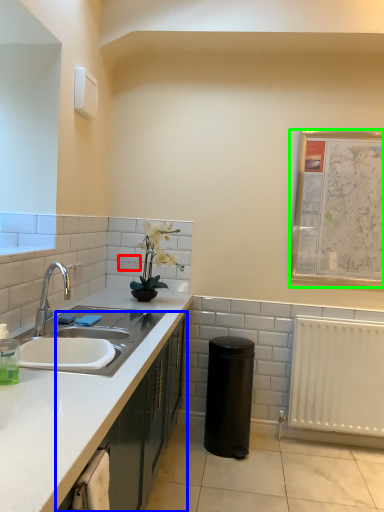
Question: Which object is positioned closest to electric outlet (highlighted by a red box)? Select from cabinetry (highlighted by a blue box) and bulletin board (highlighted by a green box).

Choices:
 (A) cabinetry
 (B) bulletin board

Answer: (A)